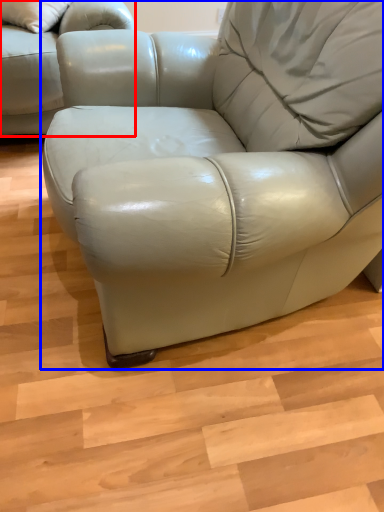
Question: Among these objects, which one is nearest to the camera, studio couch (highlighted by a red box) or table (highlighted by a blue box)?

Choices:
 (A) studio couch
 (B) table

Answer: (B)